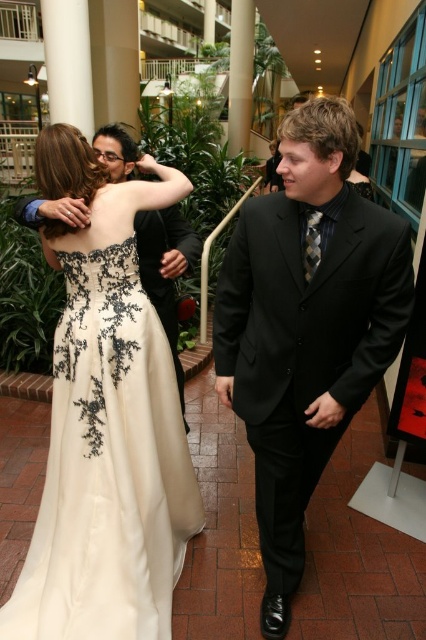
Question: Which point is closer to the camera?

Choices:
 (A) black satin suit at center
 (B) ivory satin dress at upper left

Answer: (A)

Question: Does ivory satin dress at upper left come in front of black satin suit at center?

Choices:
 (A) yes
 (B) no

Answer: (B)

Question: Does ivory satin dress at upper left have a greater width compared to black satin suit at center?

Choices:
 (A) no
 (B) yes

Answer: (B)

Question: Does ivory satin dress at upper left appear over black satin suit at center?

Choices:
 (A) no
 (B) yes

Answer: (B)

Question: Which point appears farthest from the camera in this image?

Choices:
 (A) (68, 179)
 (B) (302, 516)

Answer: (B)